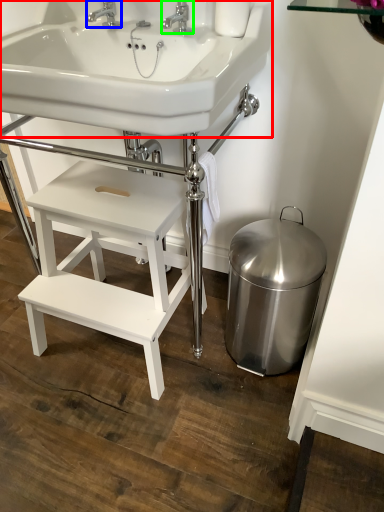
Question: Which object is the closest to the sink (highlighted by a red box)? Choose among these: tap (highlighted by a blue box) or tap (highlighted by a green box).

Choices:
 (A) tap
 (B) tap

Answer: (B)